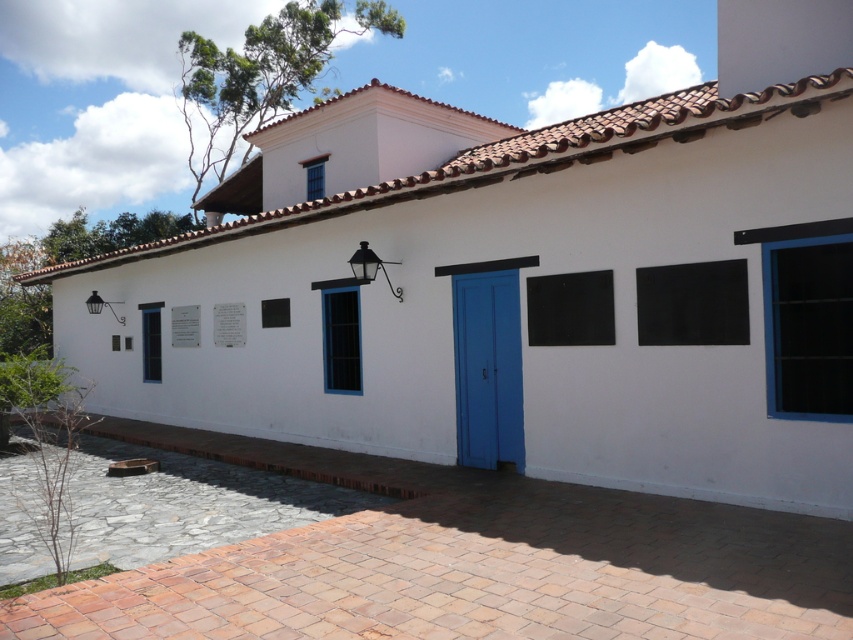
You are standing in front of the building and want to place a decorative pot exactly at the point with coordinates point (466, 563). According to the scene description, where will the pot be placed?

The point (466, 563) corresponds to brick paving at center, so the decorative pot will be placed on the brick paving at center.

Looking at this image, you are standing in front of the building and want to touch both the black matte board at center and the black glass window at center. Which object should you reach for first?

You should reach for the black matte board at center first because it is closer to you than the black glass window at center.

You are standing in front of the building and want to place a small decorative item between the two points labeled point (x=769, y=531) and point (x=529, y=323). Based on their positions, which point is closer to the entrance of the building?

Point (x=529, y=323) is closer to the entrance because it is behind point (x=769, y=531), which is further away from the entrance.